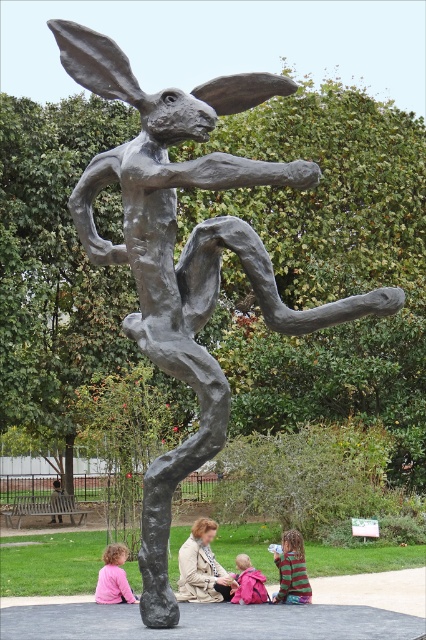
Can you confirm if light brown leather jacket at center is bigger than striped sweater at lower center?

No.

The height and width of the screenshot is (640, 426). What do you see at coordinates (201, 566) in the screenshot?
I see `light brown leather jacket at center` at bounding box center [201, 566].

Between point (213, 580) and point (273, 595), which one is positioned behind?

Positioned behind is point (213, 580).

In order to click on light brown leather jacket at center in this screenshot , I will do `click(201, 566)`.

Can you confirm if light brown leather jacket at center is shorter than pink fabric backpack at lower center?

No, light brown leather jacket at center is not shorter than pink fabric backpack at lower center.

Between point (216, 579) and point (258, 573), which one is positioned in front?

Point (258, 573) is in front.

Describe the element at coordinates (201, 566) in the screenshot. This screenshot has width=426, height=640. I see `light brown leather jacket at center` at that location.

What are the coordinates of `light brown leather jacket at center` in the screenshot? It's located at (201, 566).

From the picture: Can you confirm if light brown leather jacket at center is positioned to the right of pink fabric at lower left?

Indeed, light brown leather jacket at center is positioned on the right side of pink fabric at lower left.

Does light brown leather jacket at center have a lesser width compared to pink fabric at lower left?

In fact, light brown leather jacket at center might be wider than pink fabric at lower left.

Locate an element on the screen. This screenshot has width=426, height=640. light brown leather jacket at center is located at coordinates (201, 566).